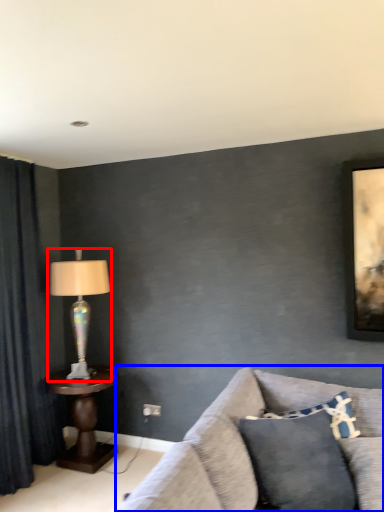
Question: Which of the following is the closest to the observer, lamp (highlighted by a red box) or studio couch (highlighted by a blue box)?

Choices:
 (A) lamp
 (B) studio couch

Answer: (B)